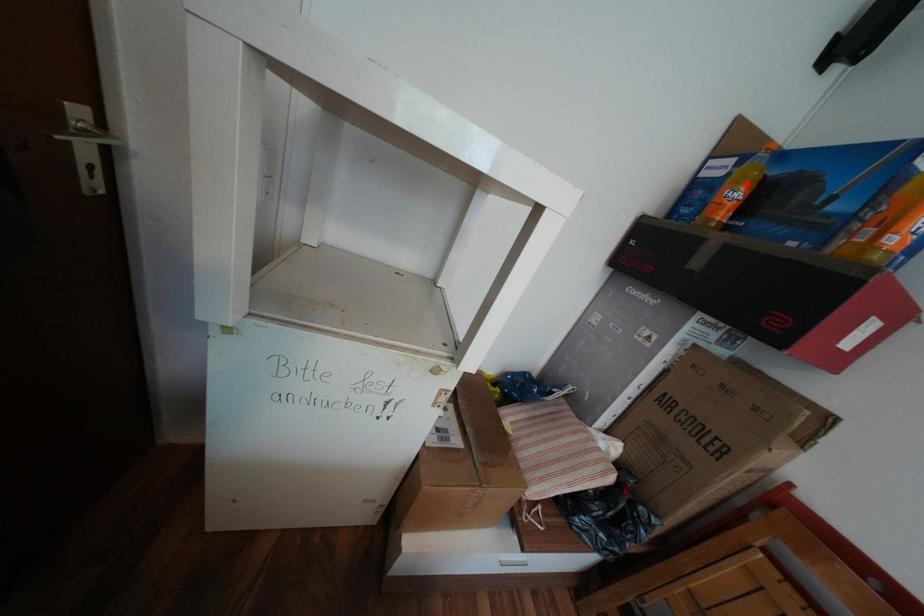
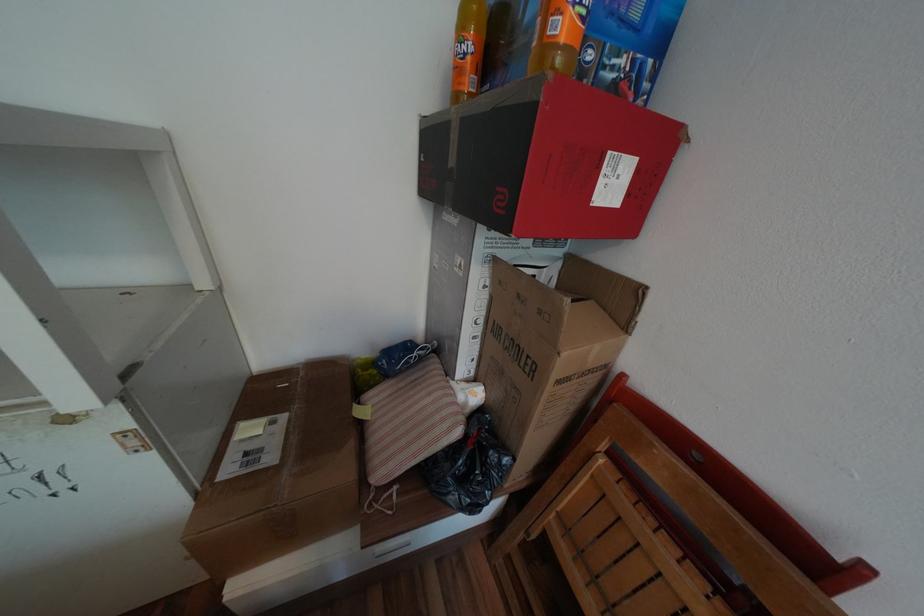
Where in the second image is the point corresponding to the highlighted location from the first image?

(472, 31)